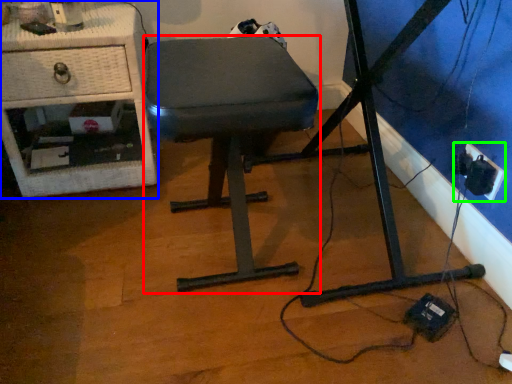
Question: Considering the real-world distances, which object is closest to stool (highlighted by a red box)? furniture (highlighted by a blue box) or electric outlet (highlighted by a green box).

Choices:
 (A) furniture
 (B) electric outlet

Answer: (A)